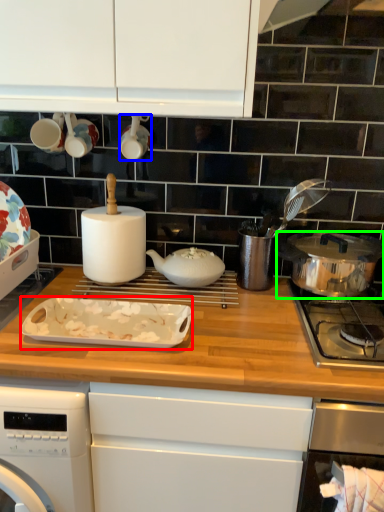
Question: Estimate the real-world distances between objects in this image. Which object is closer to kitchen appliance (highlighted by a red box), appliance (highlighted by a blue box) or kitchen appliance (highlighted by a green box)?

Choices:
 (A) appliance
 (B) kitchen appliance

Answer: (A)